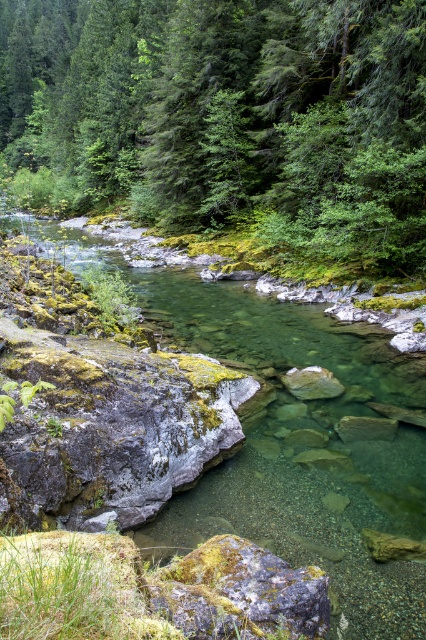
You are navigating a drone through the serene natural scene described. Your drone must avoid the green matte tree at center while flying from the left edge to the right edge of the image. Based on the coordinates provided, can you determine if the tree is positioned centrally enough to block the direct path from left to right?

The green matte tree at center is located at point coordinates, so it is positioned centrally enough to potentially block the direct path from the left to the right edge of the image.

You are standing at the riverbank in the serene natural scene. You see two points marked on the river surface. One is at point coordinates point (215, 157) and the other is at point coordinates point (221, 636). Which point is closer to you?

Point (221, 636) is closer to you because the point (215, 157) is behind it.

Looking at this image, you are a hiker who needs to cross the river. You see the green matte tree at center and the mossy gray rock at center. Which object is closer to your current position if you are standing on the riverbank directly opposite the center of the river?

The mossy gray rock at center is closer to your current position because it is positioned closer to the riverbank than the green matte tree at center.